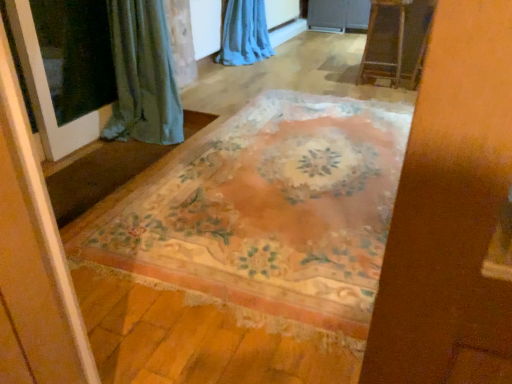
Question: Considering their positions, is floral-patterned rug at center located in front of or behind wooden ladder at upper right?

Choices:
 (A) behind
 (B) front

Answer: (B)

Question: From the image's perspective, relative to wooden ladder at upper right, is floral-patterned rug at center above or below?

Choices:
 (A) above
 (B) below

Answer: (B)

Question: Considering the real-world distances, which object is farthest from the transparent glass screen door at left?

Choices:
 (A) wooden ladder at upper right
 (B) blue sheer curtain at upper center
 (C) floral-patterned rug at center

Answer: (A)

Question: Based on their relative distances, which object is nearer to the floral-patterned rug at center?

Choices:
 (A) transparent glass screen door at left
 (B) blue sheer curtain at upper center
 (C) wooden ladder at upper right

Answer: (A)